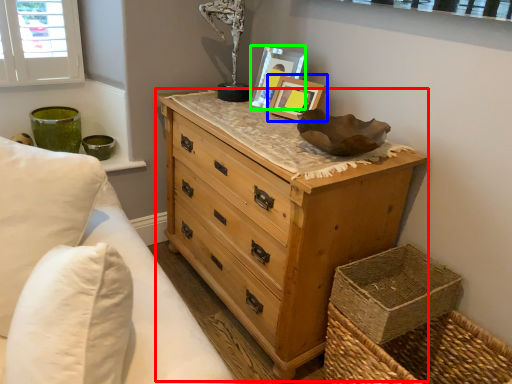
Question: Based on their relative distances, which object is nearer to chest of drawers (highlighted by a red box)? Choose from picture frame (highlighted by a blue box) and picture frame (highlighted by a green box).

Choices:
 (A) picture frame
 (B) picture frame

Answer: (A)